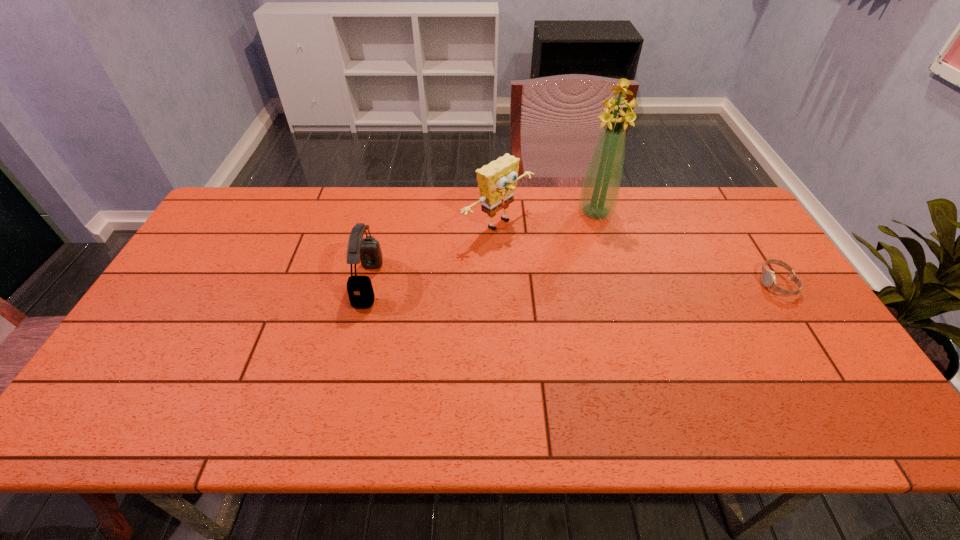
The image size is (960, 540). I want to click on free space that satisfies the following two spatial constraints: 1. on the front side of the third object from right to left; 2. on the face of the rightmost object, so click(501, 283).

Where is `vacant position in the image that satisfies the following two spatial constraints: 1. on the front side of the second object from left to right; 2. on the face of the shortest object`? This screenshot has height=540, width=960. vacant position in the image that satisfies the following two spatial constraints: 1. on the front side of the second object from left to right; 2. on the face of the shortest object is located at coordinates (501, 283).